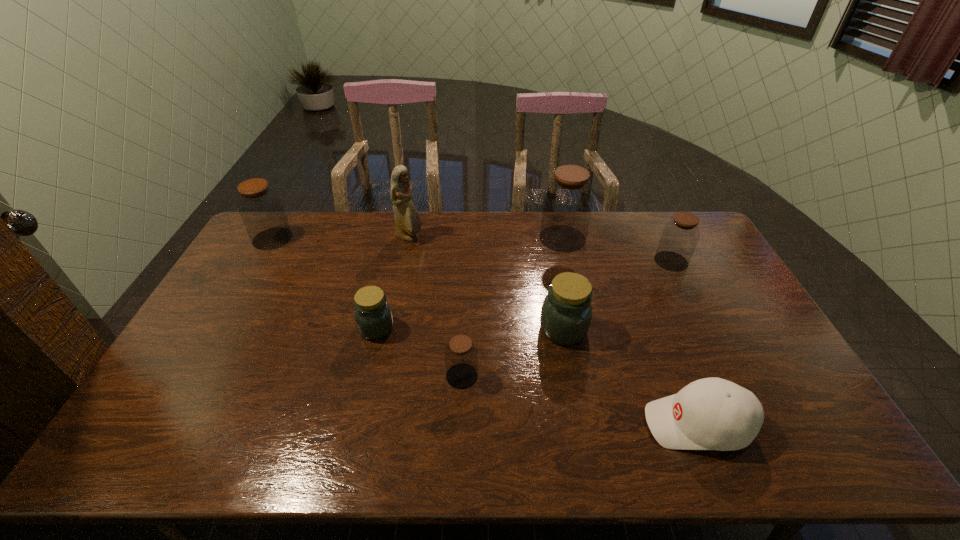
This screenshot has width=960, height=540. What are the coordinates of `vacant area at the near edge` in the screenshot? It's located at (767, 452).

Find the location of a particular element. vacant point at the left edge is located at coordinates click(268, 255).

Image resolution: width=960 pixels, height=540 pixels. In the image, there is a desktop. Identify the location of vacant region at the right edge. (724, 287).

The image size is (960, 540). In order to click on free space at the near left corner in this screenshot , I will do `click(135, 450)`.

Identify the location of vacant space that is in between the tallest jar and the nearest object. The height and width of the screenshot is (540, 960). (630, 331).

This screenshot has height=540, width=960. I want to click on vacant region between the third biggest brown jar and the bigger green jar, so click(x=617, y=295).

The width and height of the screenshot is (960, 540). What are the coordinates of `free area in between the leftmost object and the white baseball cap` in the screenshot? It's located at (485, 331).

Locate an element on the screen. free spot between the right green jar and the seventh farthest object is located at coordinates (513, 353).

The width and height of the screenshot is (960, 540). I want to click on vacant area that lies between the left green jar and the nearest brown jar, so (420, 352).

Where is `empty space between the figurine and the right green jar`? This screenshot has height=540, width=960. empty space between the figurine and the right green jar is located at coordinates (487, 284).